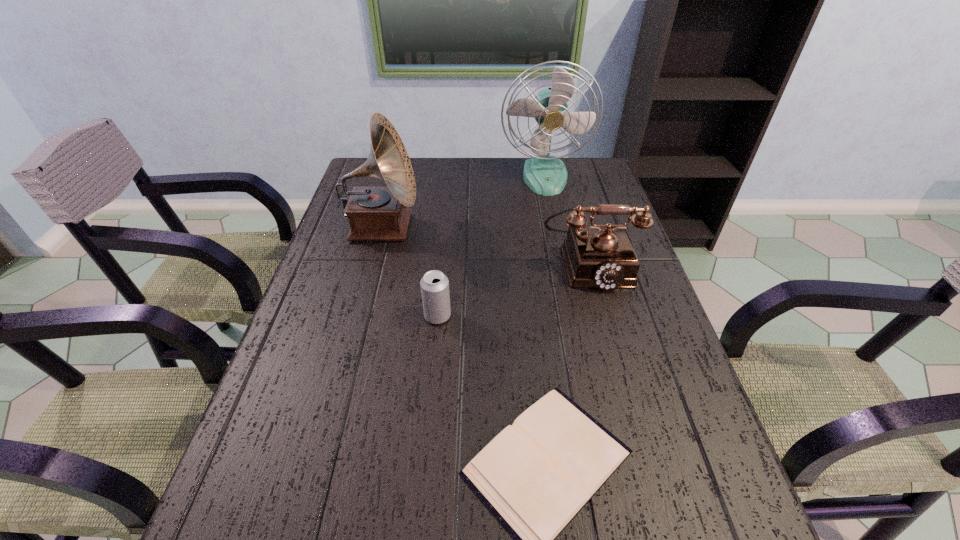
This screenshot has height=540, width=960. I want to click on object that is at the left edge, so click(x=374, y=213).

The width and height of the screenshot is (960, 540). What are the coordinates of `fan situated at the right edge` in the screenshot? It's located at (545, 174).

The image size is (960, 540). I want to click on telephone located in the right edge section of the desktop, so click(x=600, y=256).

I want to click on object situated at the far right corner, so click(545, 174).

Locate an element on the screen. The height and width of the screenshot is (540, 960). vacant space at the far edge of the desktop is located at coordinates (462, 178).

In the image, there is a desktop. In order to click on free region at the left edge in this screenshot , I will do `click(309, 403)`.

In the image, there is a desktop. At what (x,y) coordinates should I click in order to perform the action: click on vacant space at the right edge. Please return your answer as a coordinate pair (x, y). This screenshot has width=960, height=540. Looking at the image, I should click on (667, 535).

Identify the location of empty location between the fourth tallest object and the farthest object. pyautogui.click(x=492, y=246).

This screenshot has height=540, width=960. Find the location of `free space that is in between the third shortest object and the leftmost object`. free space that is in between the third shortest object and the leftmost object is located at coordinates (486, 246).

This screenshot has height=540, width=960. I want to click on blank region between the fourth farthest object and the farthest object, so click(492, 246).